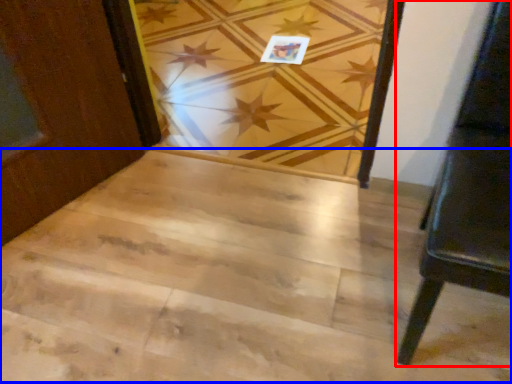
Question: Which object is further to the camera taking this photo, furniture (highlighted by a red box) or stairwell (highlighted by a blue box)?

Choices:
 (A) furniture
 (B) stairwell

Answer: (B)